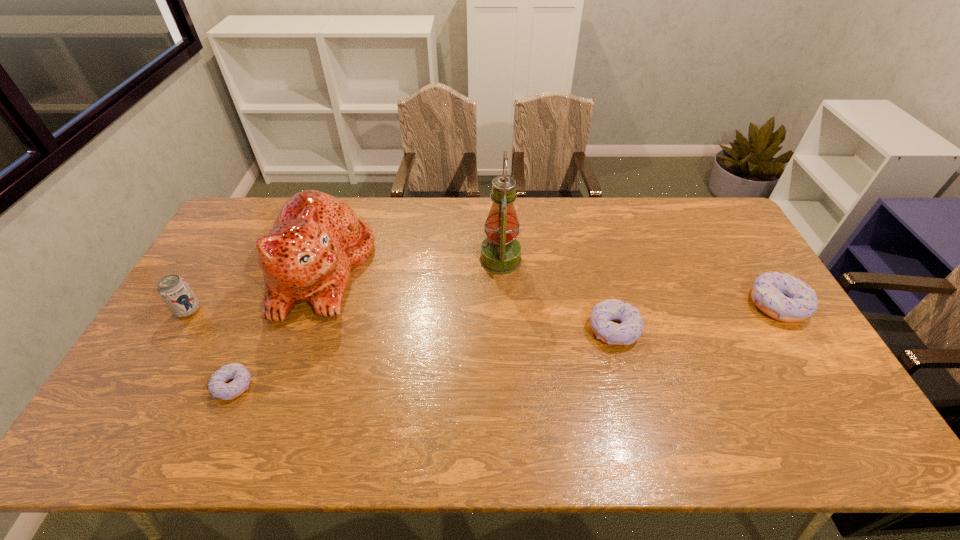
At what (x,y) coordinates should I click in order to perform the action: click on the shortest object. Please return your answer as a coordinate pair (x, y). Looking at the image, I should click on (217, 386).

The width and height of the screenshot is (960, 540). I want to click on the shortest doughnut, so 217,386.

The image size is (960, 540). What are the coordinates of `the second shortest object` in the screenshot? It's located at (629, 330).

Where is `the second tallest doughnut`? The image size is (960, 540). the second tallest doughnut is located at coordinates (629, 330).

Locate an element on the screen. This screenshot has height=540, width=960. the rightmost object is located at coordinates (786, 298).

The image size is (960, 540). In order to click on the second tallest object in this screenshot , I will do `click(316, 240)`.

Find the location of a particular element. This screenshot has height=540, width=960. oil lamp is located at coordinates (500, 252).

Locate an element on the screen. The height and width of the screenshot is (540, 960). the tallest object is located at coordinates (500, 252).

Image resolution: width=960 pixels, height=540 pixels. I want to click on the leftmost object, so click(x=173, y=289).

Locate an element on the screen. beer can is located at coordinates (173, 289).